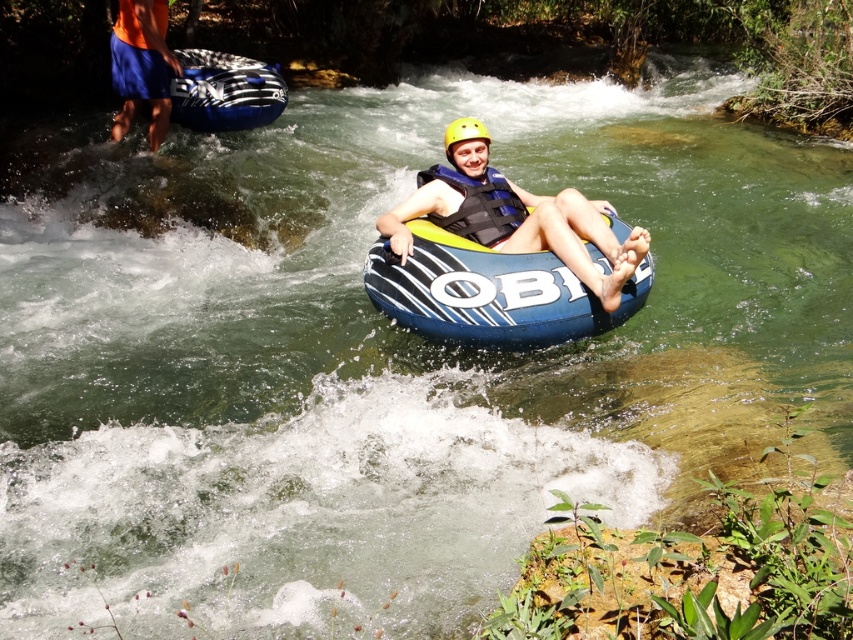
Question: Which point appears closest to the camera in this image?

Choices:
 (A) (457, 209)
 (B) (531, 269)
 (C) (219, 106)

Answer: (B)

Question: Does blue striped raft at center have a lesser width compared to matte blue tube at center?

Choices:
 (A) no
 (B) yes

Answer: (A)

Question: Does blue striped raft at upper left appear over blue/textured life jacket at center?

Choices:
 (A) no
 (B) yes

Answer: (B)

Question: Which point is closer to the camera?

Choices:
 (A) (242, 112)
 (B) (602, 232)

Answer: (B)

Question: Can you confirm if blue striped raft at center is positioned above blue/textured life jacket at center?

Choices:
 (A) no
 (B) yes

Answer: (A)

Question: Among these objects, which one is nearest to the camera?

Choices:
 (A) blue striped raft at center
 (B) blue striped raft at upper left

Answer: (A)